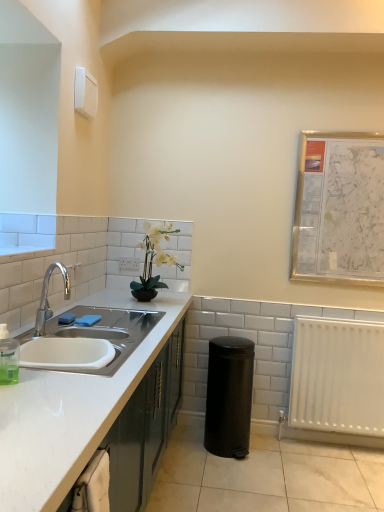
Find the location of a particular element. This screenshot has width=384, height=512. free area below silver metallic map at upper right (from a real-world perspective) is located at coordinates [x=355, y=301].